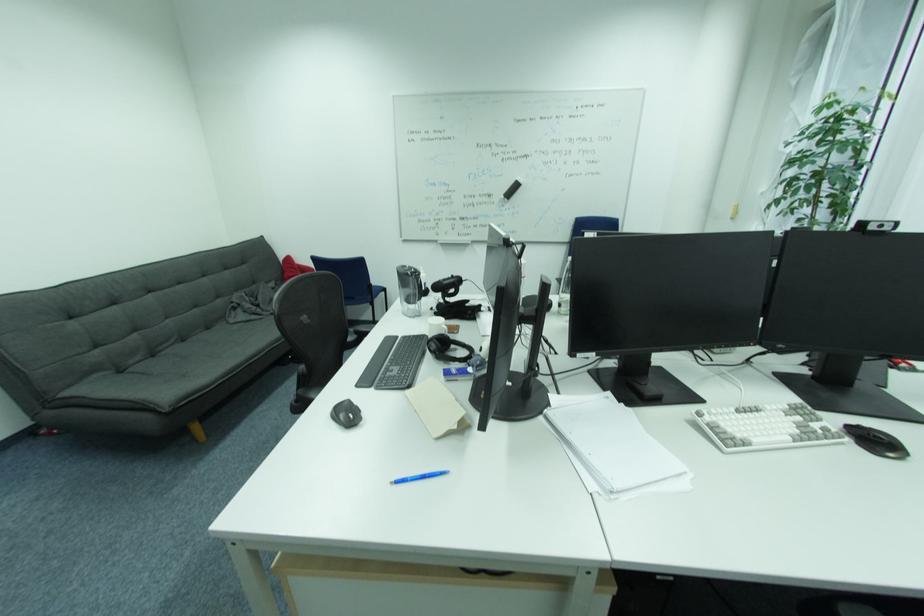
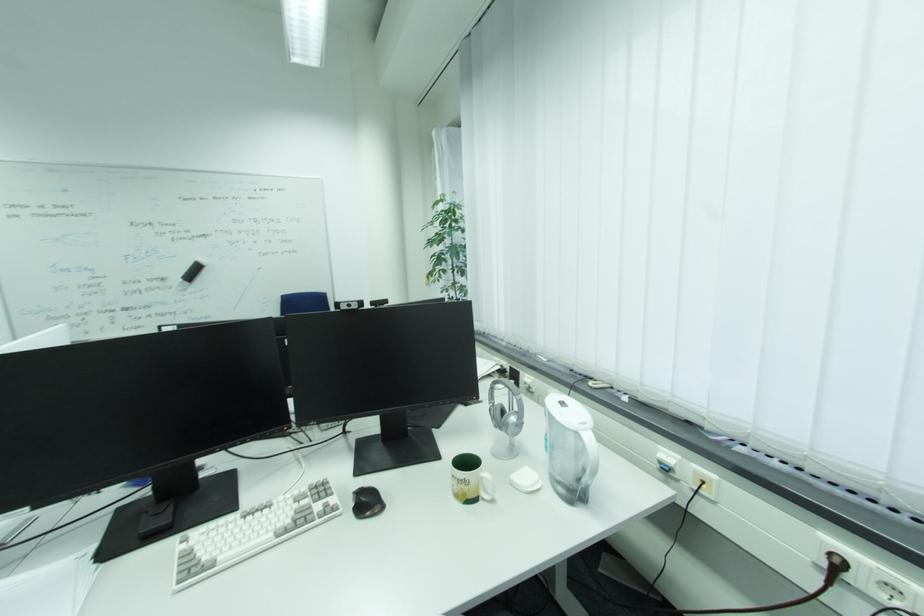
Locate, in the second image, the point that corresponds to (878,224) in the first image.

(348, 304)